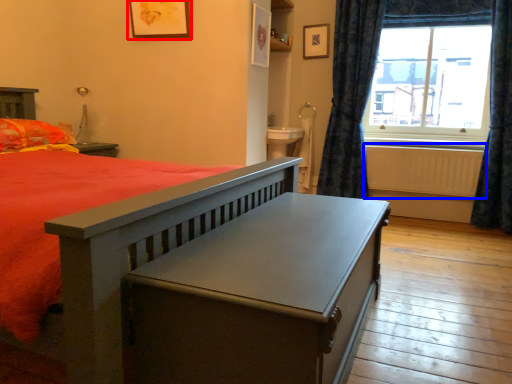
Question: Which object appears closest to the camera in this image, picture frame (highlighted by a red box) or radiator (highlighted by a blue box)?

Choices:
 (A) picture frame
 (B) radiator

Answer: (A)